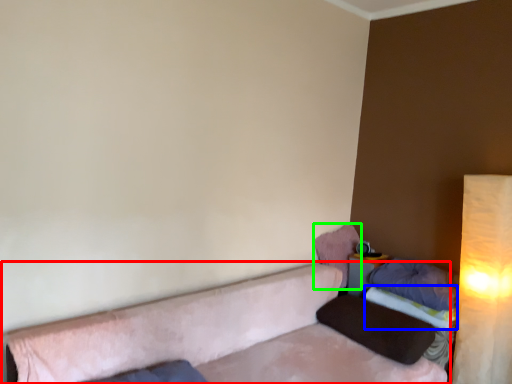
Question: Based on their relative distances, which object is nearer to studio couch (highlighted by a red box)? Choose from sheet (highlighted by a blue box) and pillow (highlighted by a green box).

Choices:
 (A) sheet
 (B) pillow

Answer: (B)